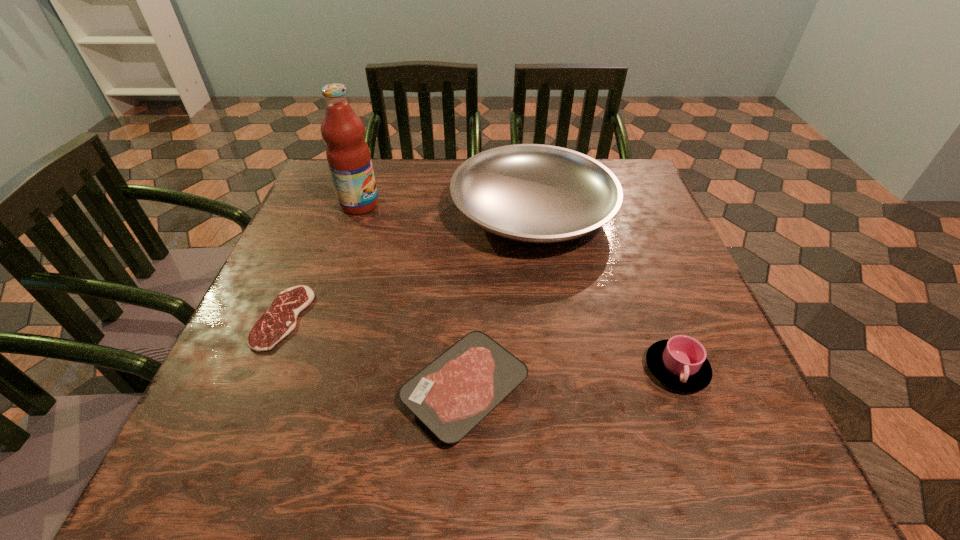
Find the location of a particular element. Image resolution: width=960 pixels, height=540 pixels. the tallest object is located at coordinates (348, 155).

Identify the location of bedpan. The image size is (960, 540). (533, 193).

The image size is (960, 540). In order to click on cup in this screenshot , I will do `click(680, 363)`.

Where is `the taller steak`? the taller steak is located at coordinates (451, 395).

Locate an element on the screen. The image size is (960, 540). the second shortest object is located at coordinates (451, 395).

In order to click on the shortest object in this screenshot , I will do `click(280, 319)`.

In order to click on the left steak in this screenshot , I will do `click(280, 319)`.

Identify the location of vacant area situated 0.220m on the front label of the fruit juice. (468, 205).

Image resolution: width=960 pixels, height=540 pixels. What are the coordinates of `free space located 0.350m on the left of the second tallest object` in the screenshot? It's located at (306, 213).

The height and width of the screenshot is (540, 960). Find the location of `vacant area located on the back of the second shortest object`. vacant area located on the back of the second shortest object is located at coordinates coord(470,209).